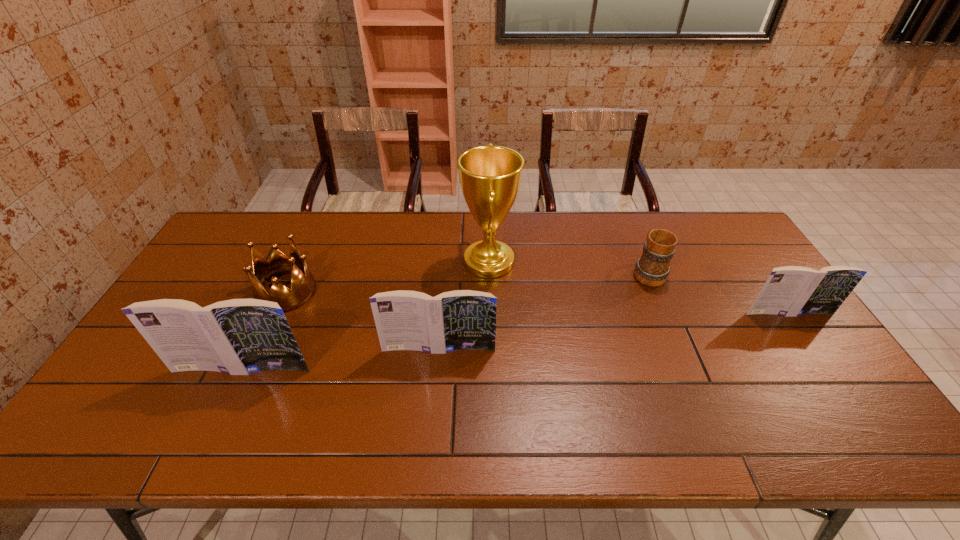
Where is `free space located 0.050m on the front cover of the second tallest book`? Image resolution: width=960 pixels, height=540 pixels. free space located 0.050m on the front cover of the second tallest book is located at coordinates (437, 370).

You are a GUI agent. You are given a task and a screenshot of the screen. Output one action in this format:
    pyautogui.click(x=<x>, y=<y>)
    Task: Click on the blank area located 0.110m on the front cover of the rightmost book
    
    Given the screenshot: What is the action you would take?
    pyautogui.click(x=812, y=348)

You are a GUI agent. You are given a task and a screenshot of the screen. Output one action in this format:
    pyautogui.click(x=<x>, y=<y>)
    Task: Click on the free space located 0.280m by the handles of the tallest object
    
    Given the screenshot: What is the action you would take?
    pyautogui.click(x=375, y=262)

I want to click on vacant space located by the handles of the tallest object, so click(x=366, y=262).

Locate an element on the screen. This screenshot has height=540, width=960. vacant region located by the handles of the tallest object is located at coordinates (406, 262).

Find the location of `free space located 0.110m on the side of the mug with the handle`. free space located 0.110m on the side of the mug with the handle is located at coordinates (634, 237).

Locate an element on the screen. The image size is (960, 540). free region located 0.220m on the side of the mug with the handle is located at coordinates (626, 218).

The image size is (960, 540). In order to click on free location located 0.210m on the side of the mug with the handle in this screenshot , I will do `click(626, 220)`.

Identify the location of free point located on the back of the crown. This screenshot has width=960, height=540. (321, 215).

Where is `object that is at the far edge`? object that is at the far edge is located at coordinates (490, 176).